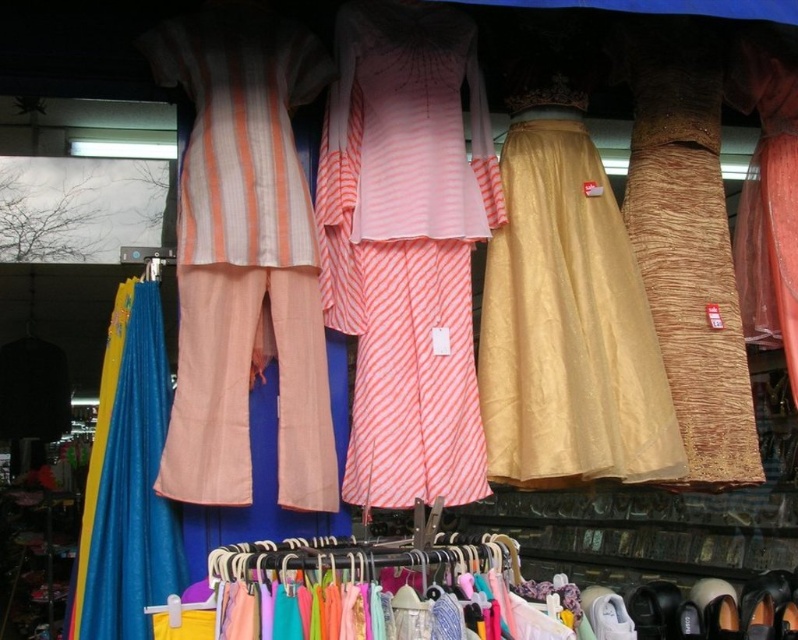
You are a customer in the store and want to try on the pink striped fabric dress at center and the shiny brown shoe at lower right. How far apart are these items from each other?

The distance between the pink striped fabric dress at center and the shiny brown shoe at lower right is 38.11 inches.

You are a customer in a traditional clothing store and see the striped peach pants at left and the blue fabric at left. Which one is placed on top?

The striped peach pants at left is positioned over the blue fabric at left, so the striped peach pants at left is placed on top.